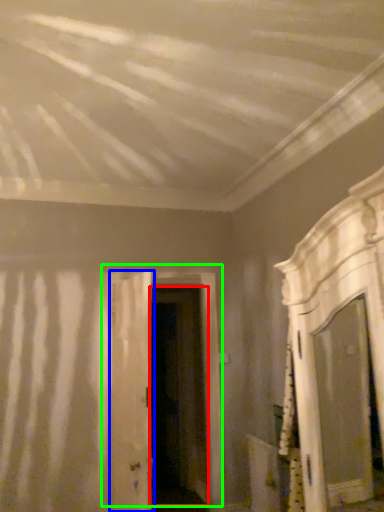
Question: Which is nearer to the door (highlighted by a red box)? door (highlighted by a blue box) or door (highlighted by a green box).

Choices:
 (A) door
 (B) door

Answer: (B)